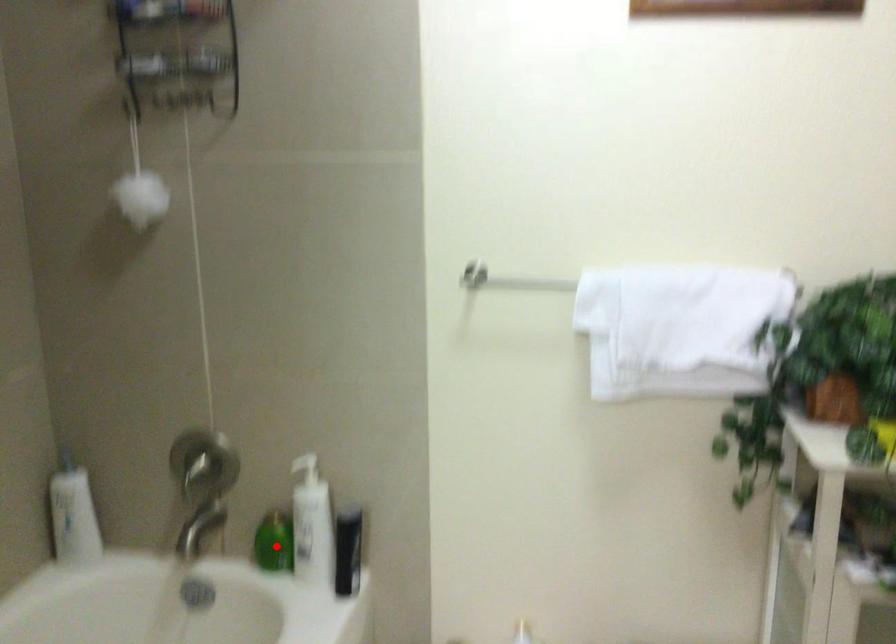
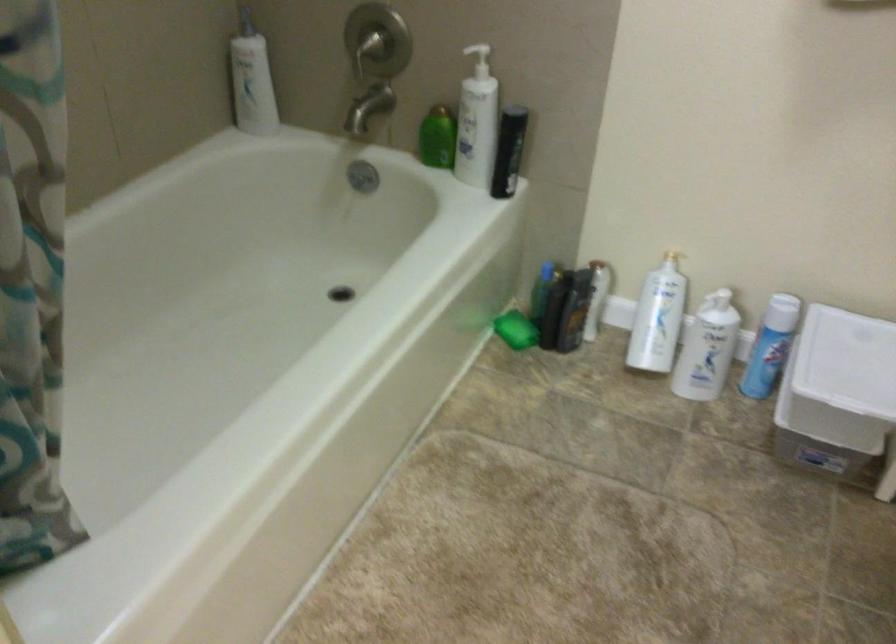
Find the pixel in the second image that matches the highlighted location in the first image.

(437, 138)